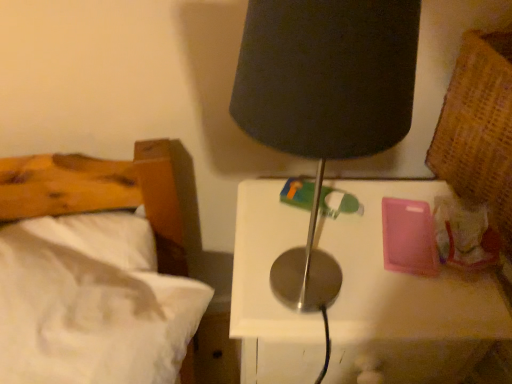
Question: In terms of height, does white soft bed at left look taller or shorter compared to metallic white nightstand at center?

Choices:
 (A) short
 (B) tall

Answer: (A)

Question: Considering their positions, is white soft bed at left located in front of or behind metallic white nightstand at center?

Choices:
 (A) front
 (B) behind

Answer: (A)

Question: Which object is the farthest from the white soft bed at left?

Choices:
 (A) metallic white nightstand at center
 (B) black fabric lamp at upper center

Answer: (B)

Question: Estimate the real-world distances between objects in this image. Which object is closer to the metallic white nightstand at center?

Choices:
 (A) white soft bed at left
 (B) black fabric lamp at upper center

Answer: (A)